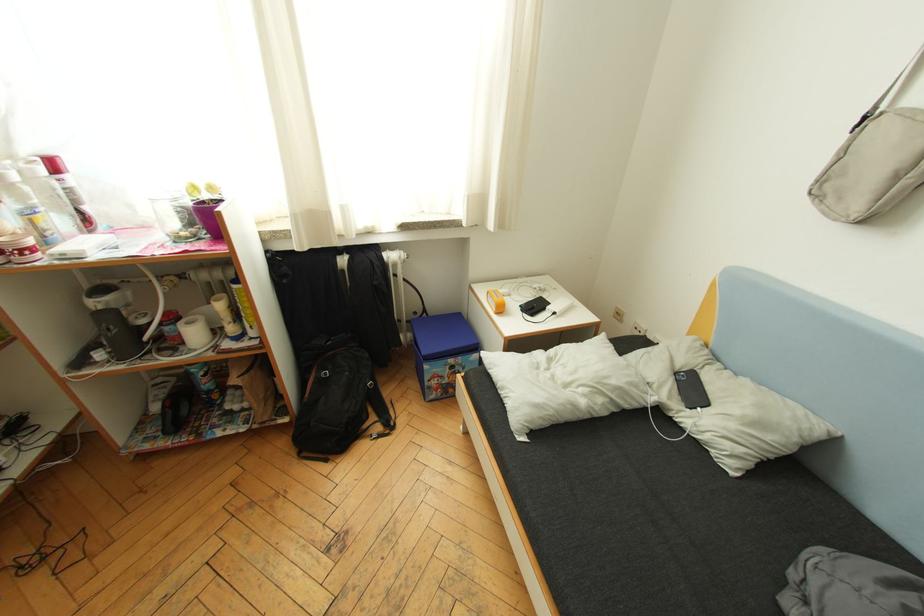
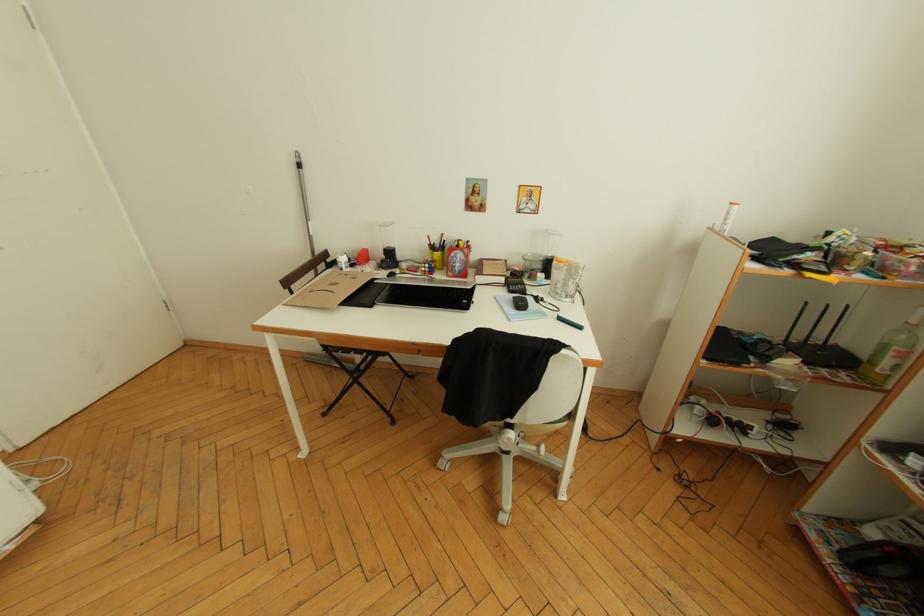
The images are taken continuously from a first-person perspective. In which direction is your viewpoint rotating?

The camera rotated toward left-down.